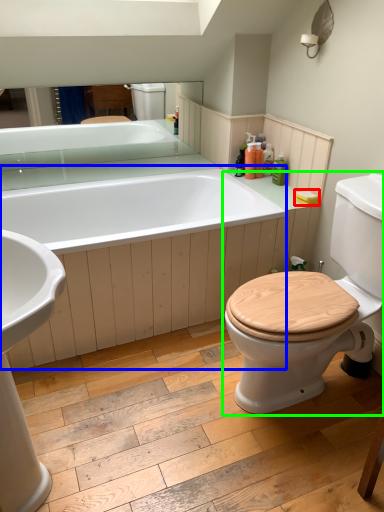
Question: Which is nearer to the toilet paper (highlighted by a red box)? bath (highlighted by a blue box) or toilet (highlighted by a green box).

Choices:
 (A) bath
 (B) toilet

Answer: (B)